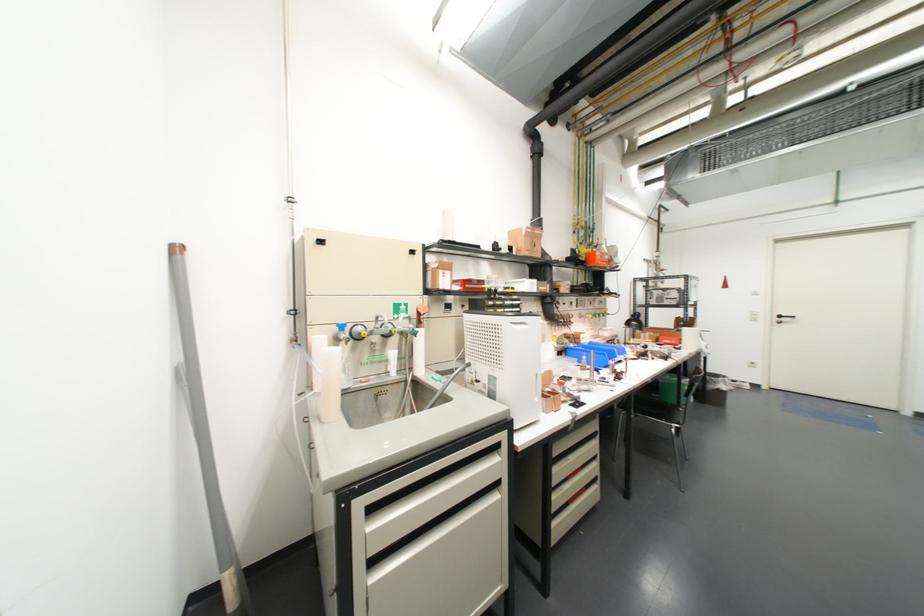
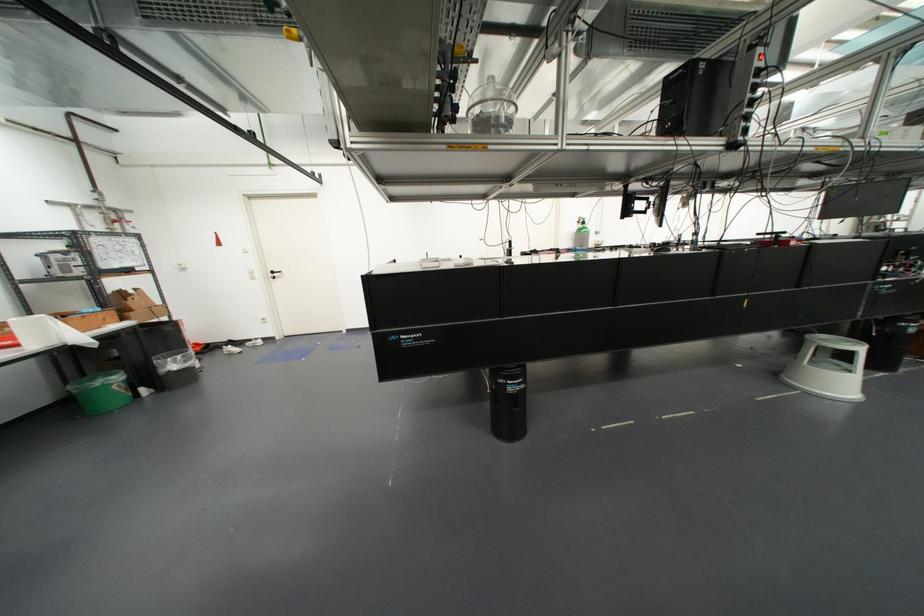
Locate, in the second image, the point that corresponds to (724,285) in the first image.

(217, 243)